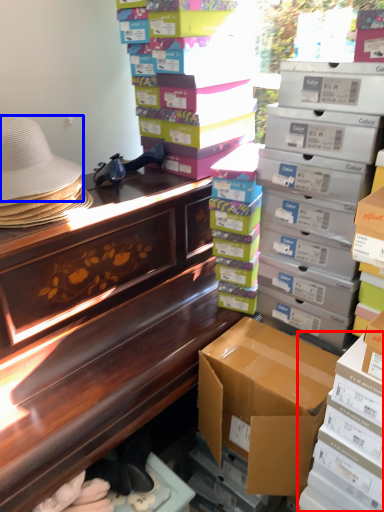
Question: Which object appears farthest to the camera in this image, box (highlighted by a red box) or hat (highlighted by a blue box)?

Choices:
 (A) box
 (B) hat

Answer: (B)